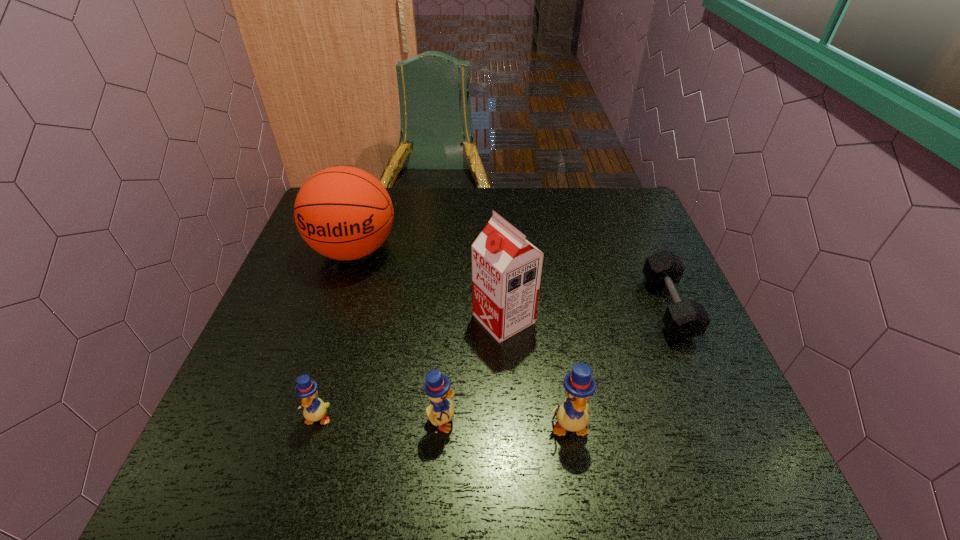
Where is `the leftmost duckling`? The width and height of the screenshot is (960, 540). the leftmost duckling is located at coordinates (314, 409).

In order to click on the fifth tallest object in this screenshot , I will do 314,409.

Locate an element on the screen. the second shortest duckling is located at coordinates (437, 387).

The height and width of the screenshot is (540, 960). Identify the location of the third shortest object. (437, 387).

Locate an element on the screen. This screenshot has height=540, width=960. the fifth object from left to right is located at coordinates (572, 415).

I want to click on basketball, so click(x=344, y=213).

You are a GUI agent. You are given a task and a screenshot of the screen. Output one action in this format:
    pyautogui.click(x=<x>, y=<y>)
    Task: Click on the shortest object
    The height and width of the screenshot is (540, 960).
    Given the screenshot: What is the action you would take?
    pyautogui.click(x=685, y=319)

Where is `the rightmost object`? the rightmost object is located at coordinates (685, 319).

Locate an element on the screen. soya milk is located at coordinates (506, 268).

What are the coordinates of `vacant region located on the face of the second duckling from left to right, where the monocle is placed` in the screenshot? It's located at (619, 421).